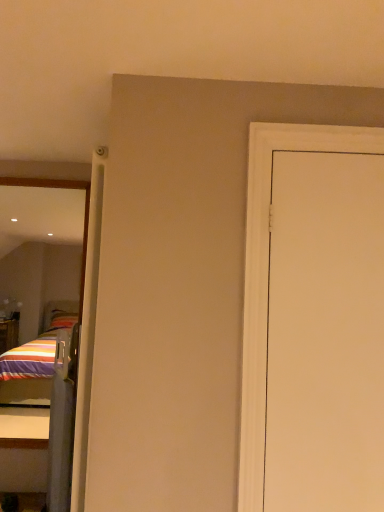
Locate an element on the screen. Image resolution: width=384 pixels, height=512 pixels. reflective glass mirror at left is located at coordinates (84, 213).

The image size is (384, 512). What do you see at coordinates (325, 334) in the screenshot? I see `white matte door at right` at bounding box center [325, 334].

You are a GUI agent. You are given a task and a screenshot of the screen. Output one action in this format:
    pyautogui.click(x=<x>, y=<y>)
    Task: Click on the reflective glass mirror at left
    This screenshot has width=384, height=512.
    Given the screenshot: What is the action you would take?
    pyautogui.click(x=84, y=213)

Who is bigger, reflective glass mirror at left or clear plastic screen door at left?

Bigger between the two is clear plastic screen door at left.

Would you say reflective glass mirror at left contains clear plastic screen door at left?

No, reflective glass mirror at left does not contain clear plastic screen door at left.

Considering the sizes of reflective glass mirror at left and clear plastic screen door at left in the image, is reflective glass mirror at left wider or thinner than clear plastic screen door at left?

In the image, reflective glass mirror at left appears to be more narrow than clear plastic screen door at left.

Can you confirm if clear plastic screen door at left is wider than reflective glass mirror at left?

Correct, the width of clear plastic screen door at left exceeds that of reflective glass mirror at left.

Is clear plastic screen door at left far from reflective glass mirror at left?

That's not correct — clear plastic screen door at left is a little close to reflective glass mirror at left.

Is clear plastic screen door at left to the right of reflective glass mirror at left from the viewer's perspective?

Correct, you'll find clear plastic screen door at left to the right of reflective glass mirror at left.

How many degrees apart are the facing directions of clear plastic screen door at left and reflective glass mirror at left?

There is a 65.8-degree angle between the facing directions of clear plastic screen door at left and reflective glass mirror at left.

Identify the location of screen door on the left of white matte door at right. (62, 421).

Between point (326, 487) and point (65, 501), which one is positioned behind?

The point (65, 501) is farther.

Is clear plastic screen door at left a part of white matte door at right?

No.

Is clear plastic screen door at left situated inside white matte door at right or outside?

clear plastic screen door at left lies outside white matte door at right.

Considering the positions of objects clear plastic screen door at left and white matte door at right in the image provided, who is in front, clear plastic screen door at left or white matte door at right?

Positioned in front is white matte door at right.

Is clear plastic screen door at left taller than white matte door at right?

In fact, clear plastic screen door at left may be shorter than white matte door at right.

Between reflective glass mirror at left and white matte door at right, which one is positioned in front?

white matte door at right is closer to the camera.

Based on the photo, who is smaller, reflective glass mirror at left or white matte door at right?

white matte door at right is smaller.

Which is more to the right, reflective glass mirror at left or white matte door at right?

Positioned to the right is white matte door at right.

Does point (79, 323) lie in front of point (281, 227)?

That is False.

Does white matte door at right have a smaller size compared to reflective glass mirror at left?

Yes, white matte door at right is smaller than reflective glass mirror at left.

Could you tell me if white matte door at right is turned towards reflective glass mirror at left?

No.

From the image's perspective, is white matte door at right located beneath reflective glass mirror at left?

No, from the image's perspective, white matte door at right is not below reflective glass mirror at left.

Can you confirm if white matte door at right is shorter than reflective glass mirror at left?

Yes.

Locate an element on the screen. The height and width of the screenshot is (512, 384). screen door on the right of reflective glass mirror at left is located at coordinates (62, 421).

Find the location of a particular element. Image resolution: width=384 pixels, height=512 pixels. screen door below the reflective glass mirror at left (from the image's perspective) is located at coordinates (62, 421).

Looking at the image, which one is located closer to white matte door at right, reflective glass mirror at left or clear plastic screen door at left?

reflective glass mirror at left lies closer to white matte door at right than the other object.

Based on their spatial positions, is clear plastic screen door at left or reflective glass mirror at left closer to white matte door at right?

reflective glass mirror at left is positioned closer to the anchor white matte door at right.

When comparing their distances from reflective glass mirror at left, does clear plastic screen door at left or white matte door at right seem closer?

clear plastic screen door at left is positioned closer to the anchor reflective glass mirror at left.

Estimate the real-world distances between objects in this image. Which object is further from clear plastic screen door at left, reflective glass mirror at left or white matte door at right?

The object further to clear plastic screen door at left is white matte door at right.

When comparing their distances from reflective glass mirror at left, does white matte door at right or clear plastic screen door at left seem closer?

The object closer to reflective glass mirror at left is clear plastic screen door at left.

Which object lies further to the anchor point clear plastic screen door at left, white matte door at right or reflective glass mirror at left?

white matte door at right lies further to clear plastic screen door at left than the other object.

Locate an element on the screen. This screenshot has height=512, width=384. screen door situated between reflective glass mirror at left and white matte door at right from left to right is located at coordinates (62, 421).